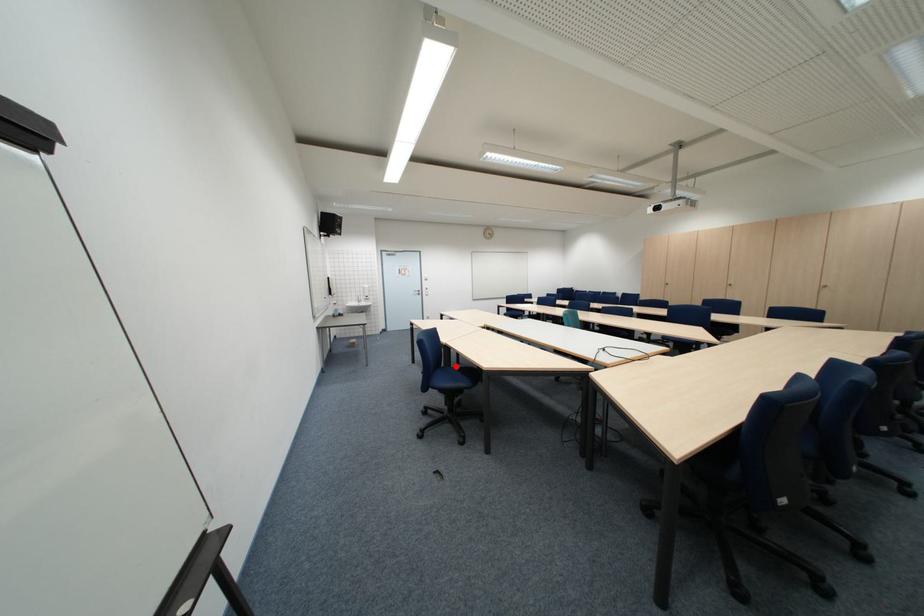
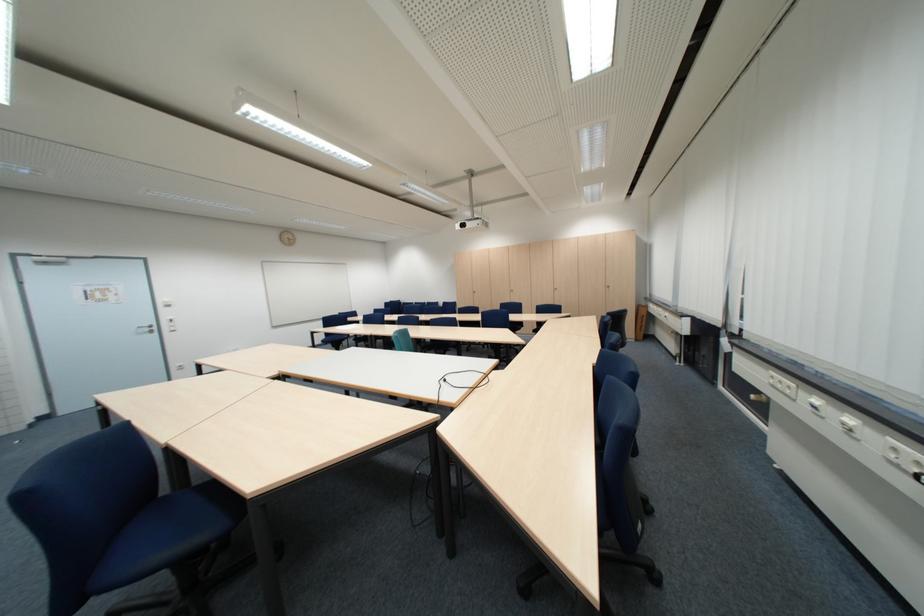
Question: I am providing you with two images of the same scene from different viewpoints. Image1 has a red point marked. In image2, the corresponding 3D location appears at what relative position? Reply with the corresponding letter.

Choices:
 (A) Closer
 (B) Farther

Answer: (A)